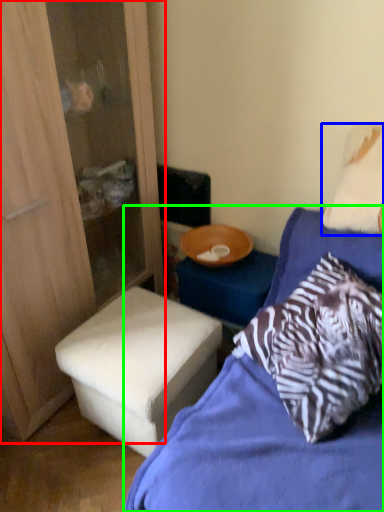
Question: Which object is positioned closest to dresser (highlighted by a red box)? Select from pillow (highlighted by a blue box) and bed (highlighted by a green box).

Choices:
 (A) pillow
 (B) bed

Answer: (B)